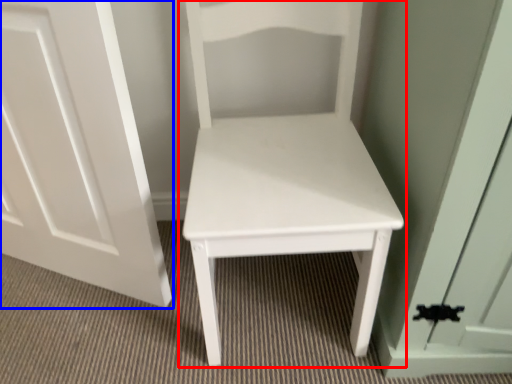
Question: Among these objects, which one is nearest to the camera, furniture (highlighted by a red box) or door (highlighted by a blue box)?

Choices:
 (A) furniture
 (B) door

Answer: (A)